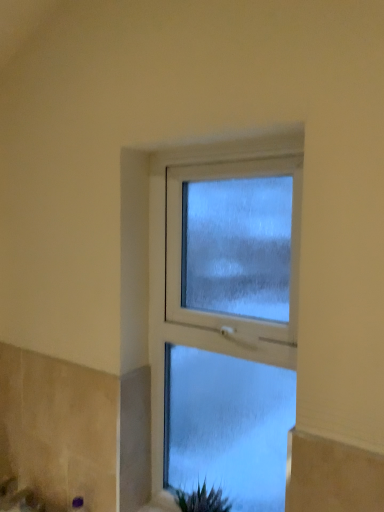
The width and height of the screenshot is (384, 512). What are the coordinates of `white frosted glass window at center` in the screenshot? It's located at (225, 316).

The width and height of the screenshot is (384, 512). What do you see at coordinates (225, 316) in the screenshot?
I see `white frosted glass window at center` at bounding box center [225, 316].

Where is `white frosted glass window at center`? white frosted glass window at center is located at coordinates (225, 316).